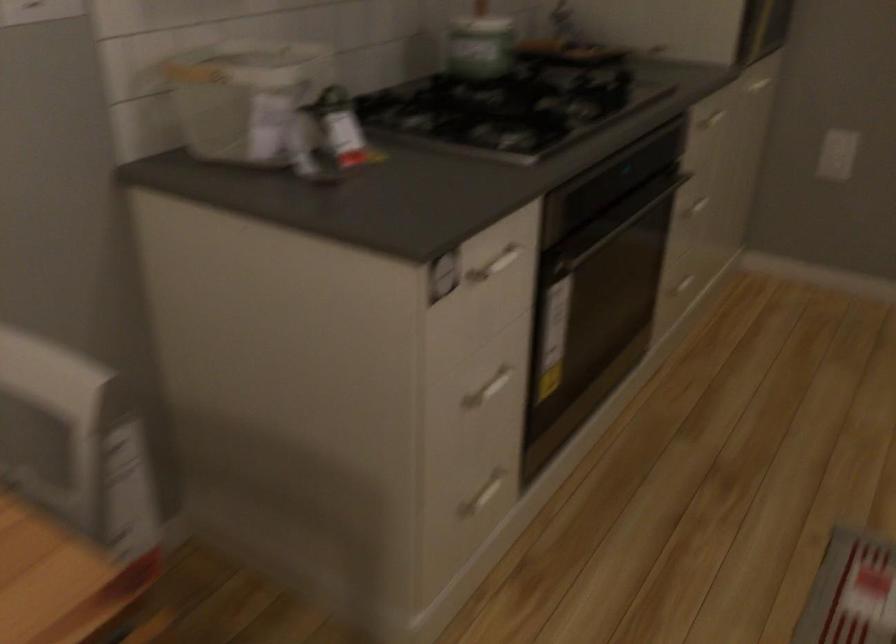
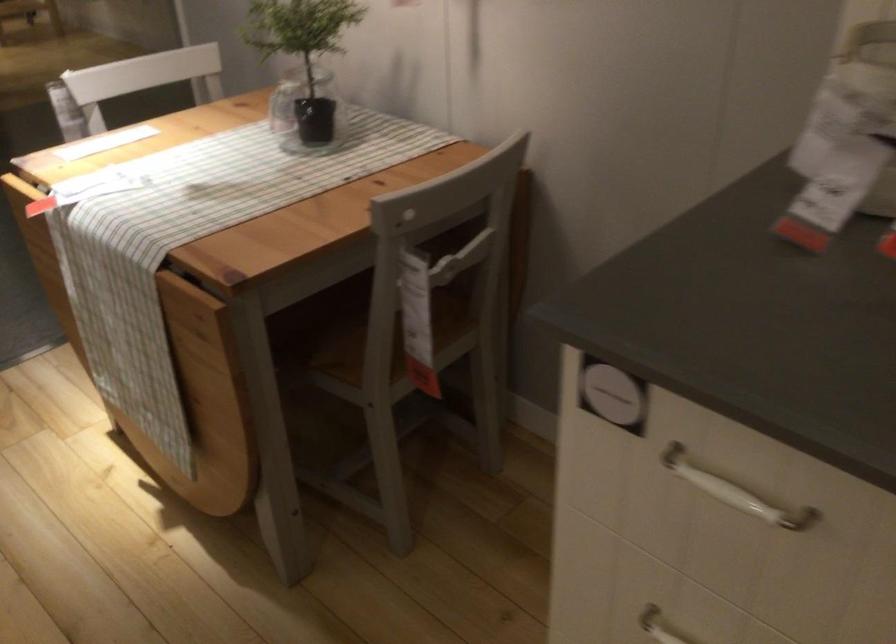
The point at [487,274] is marked in the first image. Where is the corresponding point in the second image?

(734, 491)